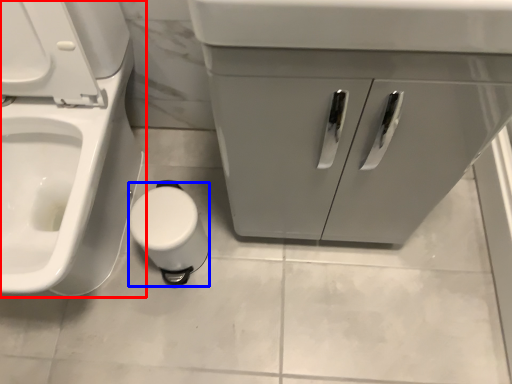
Question: Which point is closer to the camera, toilet (highlighted by a red box) or toilet paper (highlighted by a blue box)?

Choices:
 (A) toilet
 (B) toilet paper

Answer: (A)